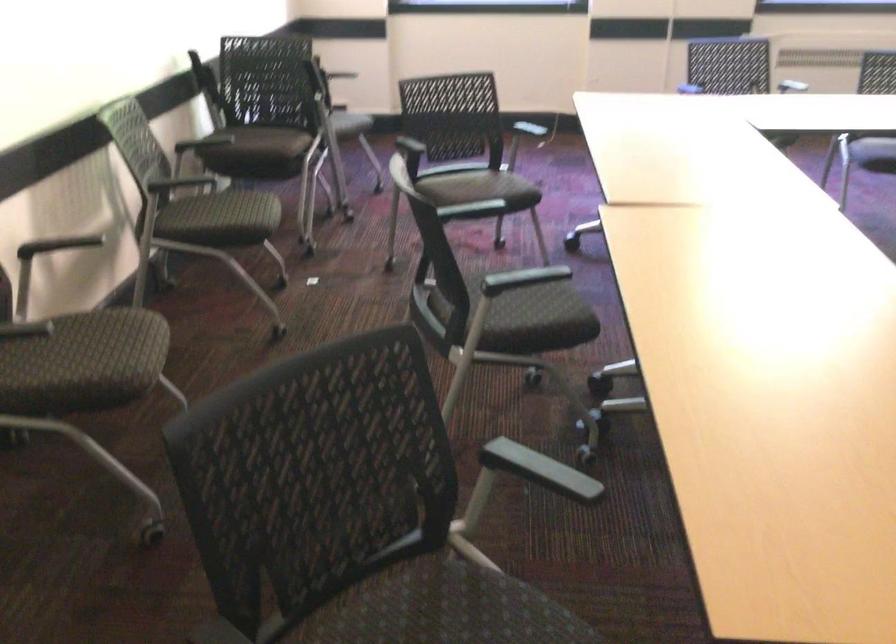
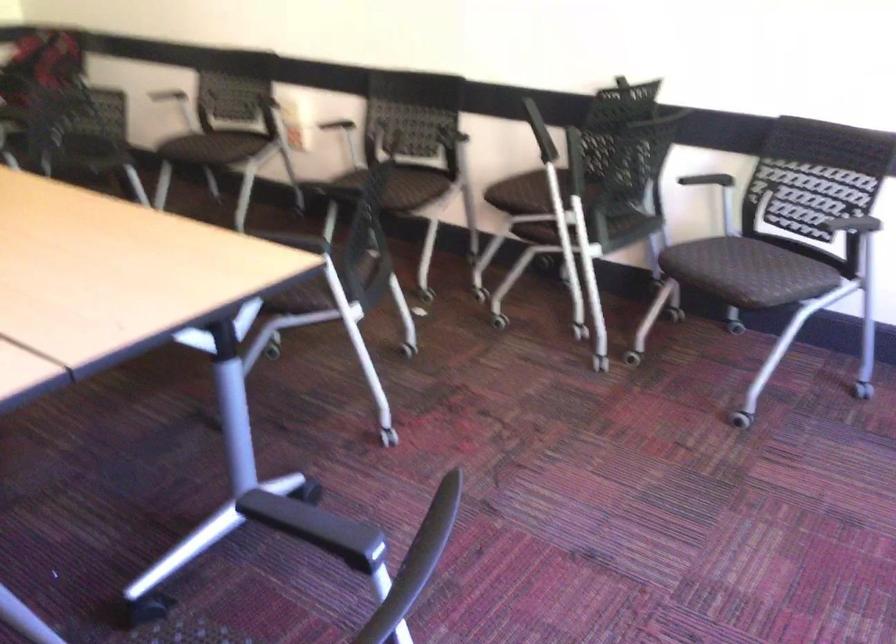
The point at (x=260, y=198) is marked in the first image. Where is the corresponding point in the second image?

(402, 187)